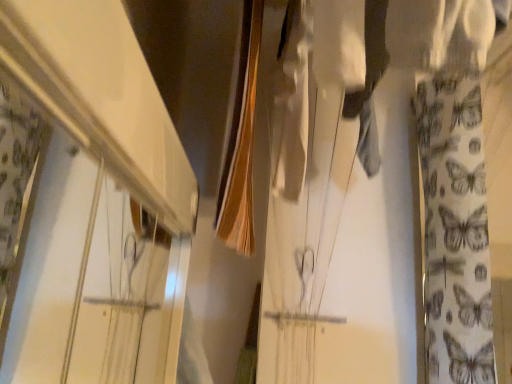
Question: Is white glossy shelf at upper left to the left or to the right of smooth brown fabric at center in the image?

Choices:
 (A) left
 (B) right

Answer: (A)

Question: Do you think white glossy shelf at upper left is within smooth brown fabric at center, or outside of it?

Choices:
 (A) outside
 (B) inside

Answer: (A)

Question: Which of these objects is positioned closest to the white fabric with butterfly pattern at right?

Choices:
 (A) white glossy shelf at upper left
 (B) smooth brown fabric at center

Answer: (B)

Question: Estimate the real-world distances between objects in this image. Which object is closer to the white glossy shelf at upper left?

Choices:
 (A) white fabric with butterfly pattern at right
 (B) smooth brown fabric at center

Answer: (B)